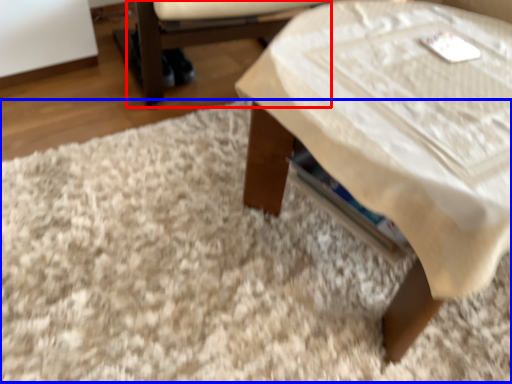
Question: Which of the following is the closest to the observer, armchair (highlighted by a red box) or mat (highlighted by a blue box)?

Choices:
 (A) armchair
 (B) mat

Answer: (B)